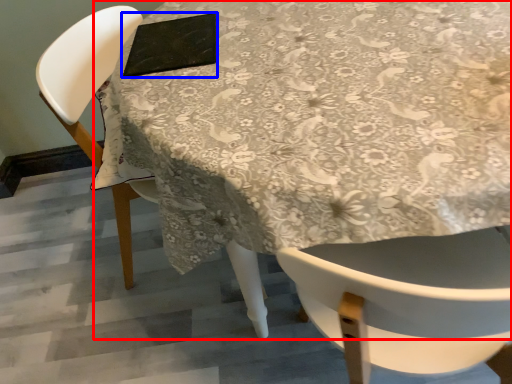
Question: Which object appears closest to the camera in this image, table (highlighted by a red box) or pad (highlighted by a blue box)?

Choices:
 (A) table
 (B) pad

Answer: (A)